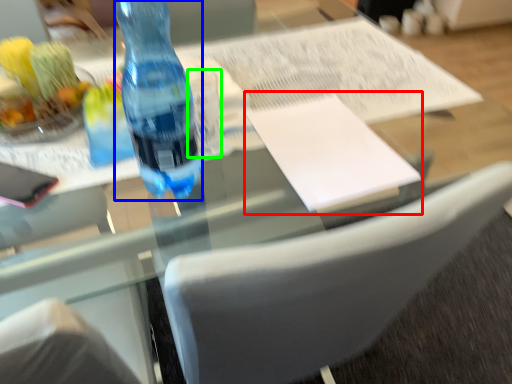
Question: Estimate the real-world distances between objects in this image. Which object is farther from journal (highlighted by a red box), bottle (highlighted by a blue box) or clear (highlighted by a green box)?

Choices:
 (A) bottle
 (B) clear

Answer: (A)